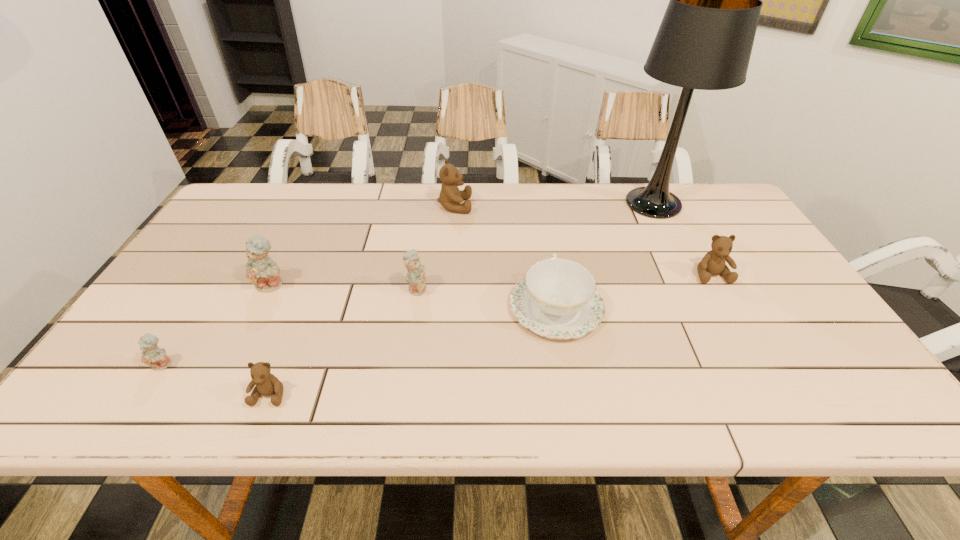
The width and height of the screenshot is (960, 540). Identify the location of blue chinaware. (557, 299).

At what (x,y) coordinates should I click in order to perform the action: click on the leftmost object. Please return your answer as a coordinate pair (x, y). Image resolution: width=960 pixels, height=540 pixels. Looking at the image, I should click on (152, 355).

Identify the location of the leftmost teddy bear. (x=152, y=355).

I want to click on the nearest teddy bear, so click(x=267, y=384).

Find the location of a particular element. the nearest object is located at coordinates 267,384.

In order to click on free space located 0.050m on the right of the black table lamp in this screenshot , I will do click(x=708, y=204).

Locate an element on the screen. The height and width of the screenshot is (540, 960). free location located 0.400m on the front-facing side of the farthest brown teddy bear is located at coordinates (596, 206).

You are a GUI agent. You are given a task and a screenshot of the screen. Output one action in this format:
    pyautogui.click(x=<x>, y=<y>)
    Task: Click on the vacant space located 0.270m on the front-facing side of the second object from left to right
    
    Given the screenshot: What is the action you would take?
    pyautogui.click(x=222, y=386)

Where is `vacant space located on the front-facing side of the second biggest blue teddy bear`? vacant space located on the front-facing side of the second biggest blue teddy bear is located at coordinates (564, 288).

You are a GUI agent. You are given a task and a screenshot of the screen. Output one action in this format:
    pyautogui.click(x=<x>, y=<y>)
    Task: Click on the blank space located on the front-facing side of the second nearest brown teddy bear
    The width and height of the screenshot is (960, 540).
    Given the screenshot: What is the action you would take?
    pyautogui.click(x=726, y=300)